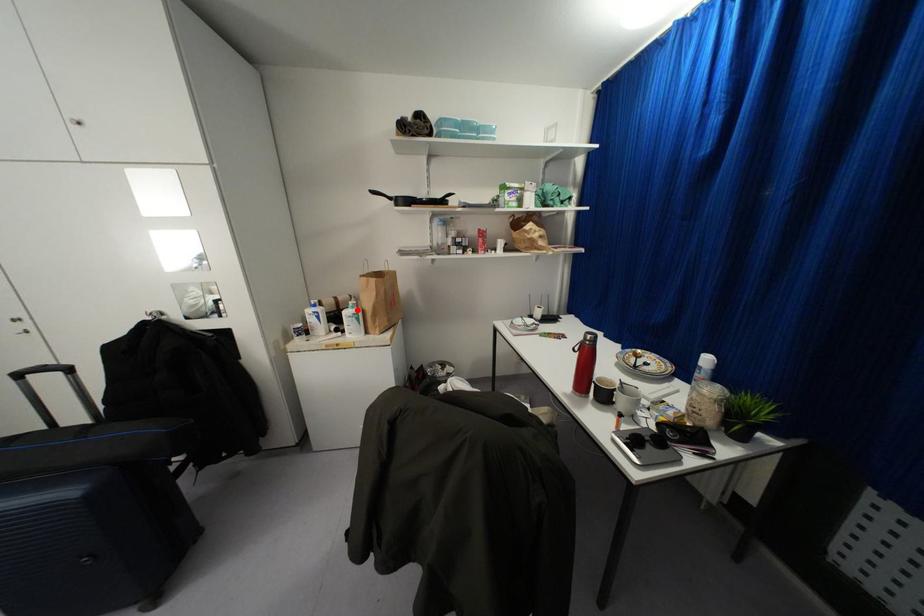
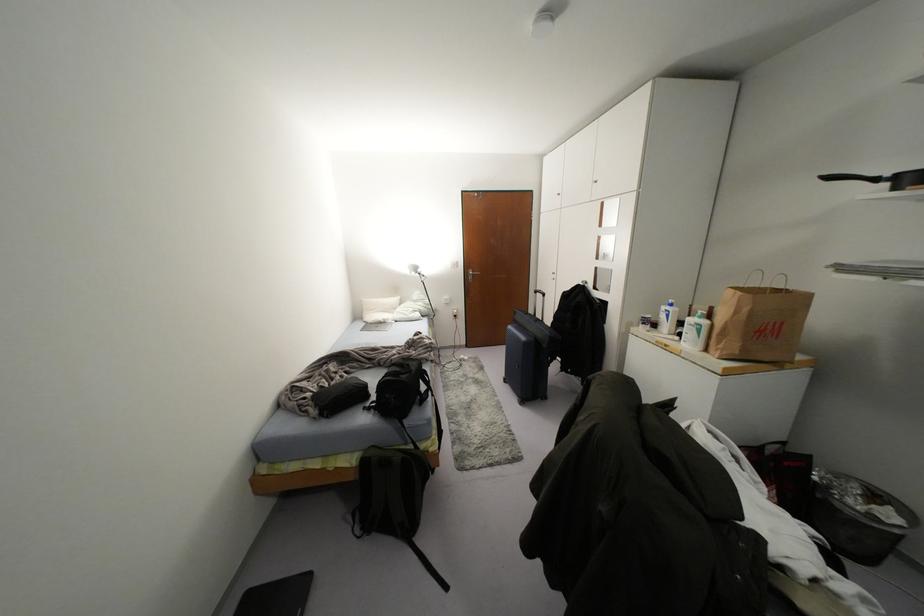
Question: A red point is marked in image1. In image2, is the corresponding 3D point closer to the camera or farther? Reply with the corresponding letter.

Choices:
 (A) The corresponding 3D point is closer.
 (B) The corresponding 3D point is farther.

Answer: (A)